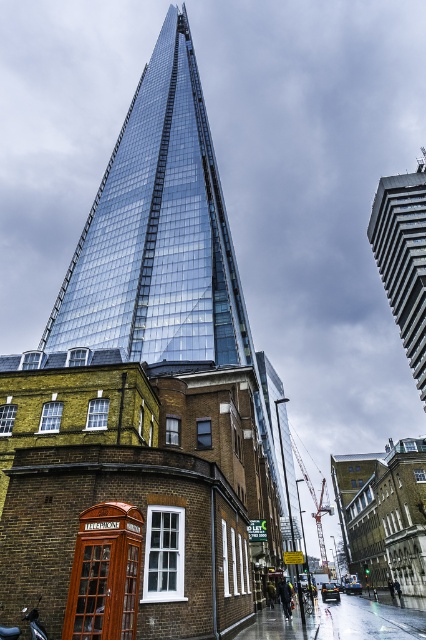
Question: Does glassy steel tower at center have a larger size compared to glassy steel building at upper right?

Choices:
 (A) no
 (B) yes

Answer: (A)

Question: Does glassy steel tower at center appear over wooden telephone box at lower left?

Choices:
 (A) yes
 (B) no

Answer: (A)

Question: Which point is closer to the camera?

Choices:
 (A) (103, 605)
 (B) (388, 241)
 (C) (37, 621)
 (D) (152, 216)

Answer: (A)

Question: Is glassy steel tower at center positioned in front of wooden telephone box at lower left?

Choices:
 (A) no
 (B) yes

Answer: (A)

Question: Considering the real-world distances, which object is farthest from the glassy steel tower at center?

Choices:
 (A) shiny chrome motorcycle at lower left
 (B) wooden telephone box at lower left
 (C) glassy steel building at upper right

Answer: (B)

Question: Which is farther from the glassy steel tower at center?

Choices:
 (A) wooden telephone box at lower left
 (B) glassy steel building at upper right
 (C) shiny chrome motorcycle at lower left

Answer: (A)